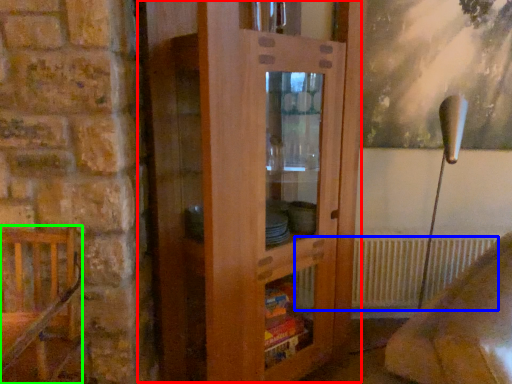
Question: Considering the real-world distances, which object is farthest from dresser (highlighted by a red box)? radiator (highlighted by a blue box) or furniture (highlighted by a green box)?

Choices:
 (A) radiator
 (B) furniture

Answer: (A)